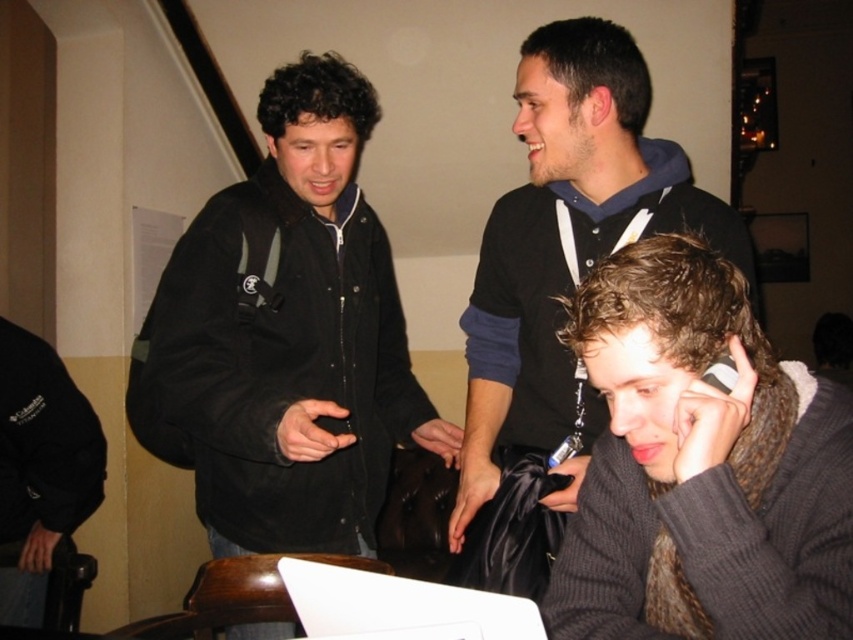
Who is more forward, (689, 188) or (512, 616)?

Point (512, 616) is more forward.

In order to click on black hoodie at upper center in this screenshot , I will do `click(560, 237)`.

Is point (602, 497) positioned behind point (486, 624)?

Yes.

Can you confirm if dark gray knitted sweater at lower right is positioned to the left of white matte laptop at center?

In fact, dark gray knitted sweater at lower right is to the right of white matte laptop at center.

Which is in front, point (564, 564) or point (372, 621)?

Point (372, 621)

This screenshot has width=853, height=640. What are the coordinates of `dark gray knitted sweater at lower right` in the screenshot? It's located at (701, 467).

Does black matte jacket at upper left have a larger size compared to dark gray knitted sweater at lower right?

Correct, black matte jacket at upper left is larger in size than dark gray knitted sweater at lower right.

Can you confirm if black matte jacket at upper left is positioned below dark gray knitted sweater at lower right?

No.

This screenshot has height=640, width=853. I want to click on black matte jacket at upper left, so click(x=286, y=337).